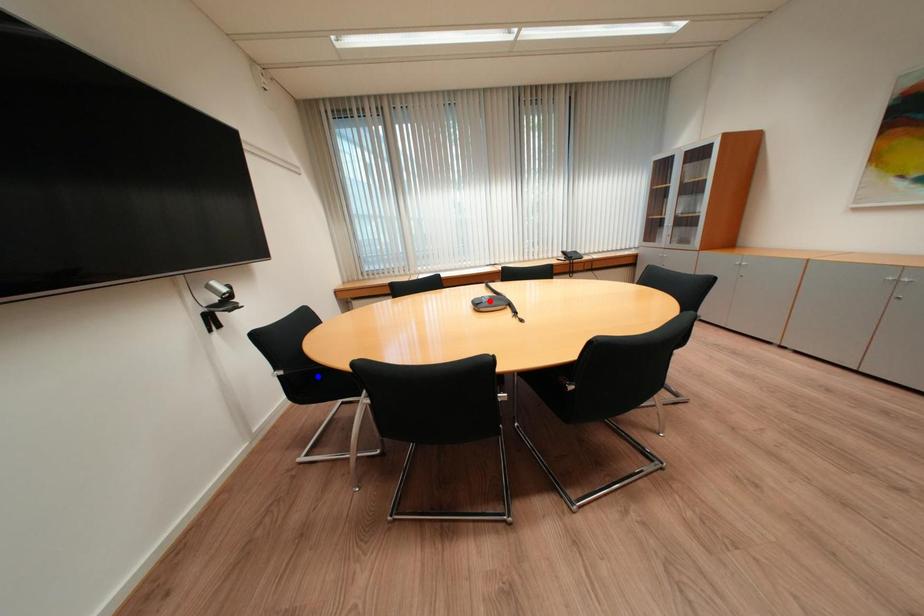
Question: Which of the two points in the image is closer to the camera?

Choices:
 (A) Blue point is closer.
 (B) Red point is closer.

Answer: (A)